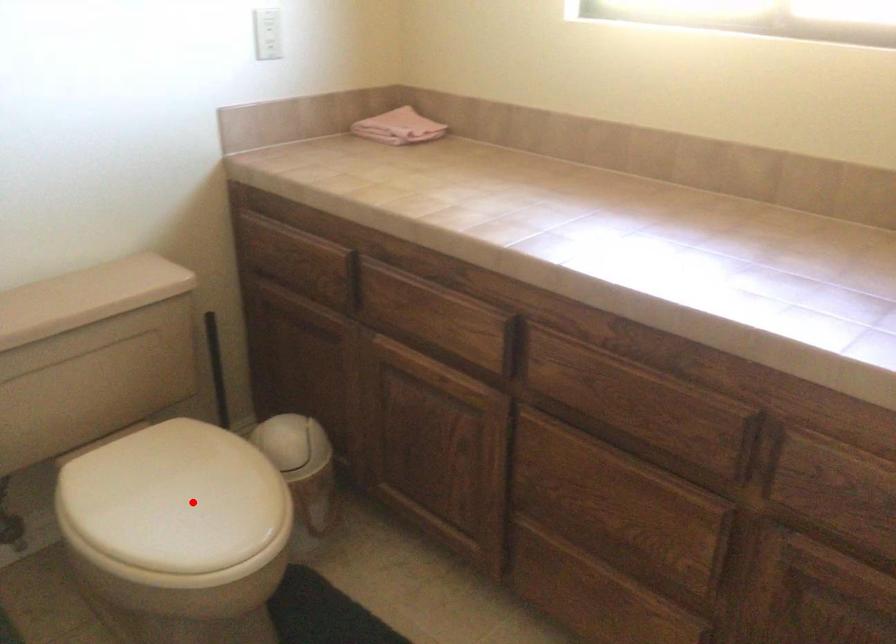
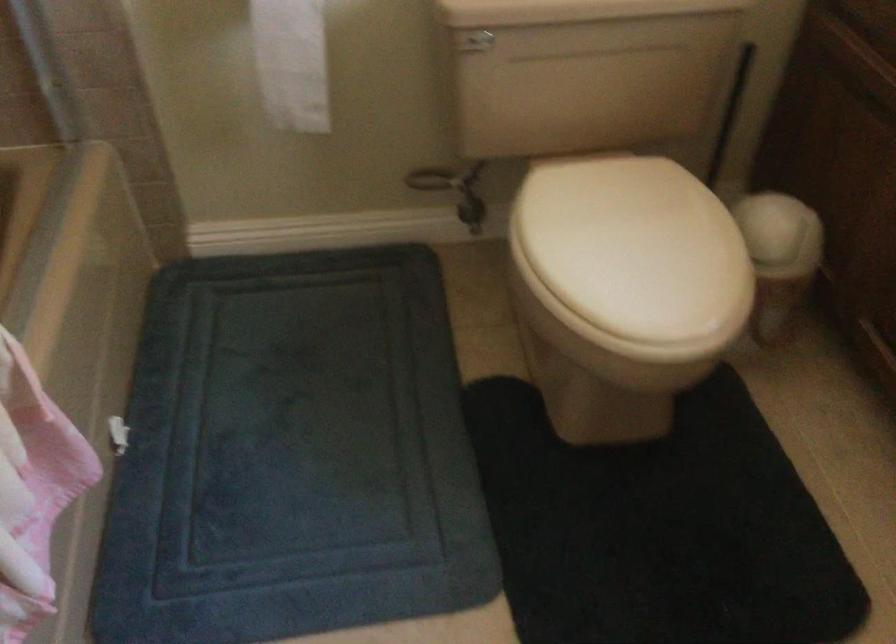
Locate, in the second image, the point that corresponds to the highlighted location in the first image.

(634, 247)